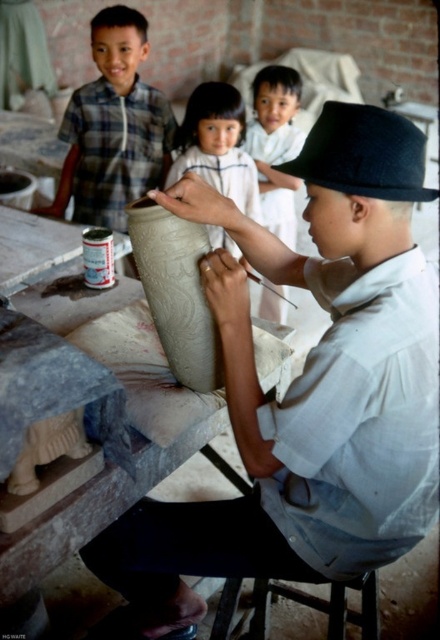
You are a photographer trying to capture the checkered fabric shirt at upper left and the smooth beige vase at center in a single photo. Since the camera can only focus on one object at a time, which object should you focus on to ensure it appears larger in the final photo?

You should focus on the checkered fabric shirt at upper left because it is bigger than the smooth beige vase at center, so it will appear larger in the photo.

You are a visitor in the pottery workshop and want to know which object is wider between the smooth beige vase at center and the white cotton shirt at upper center. Can you determine this based on their sizes?

The smooth beige vase at center is wider than the white cotton shirt at upper center according to the description.